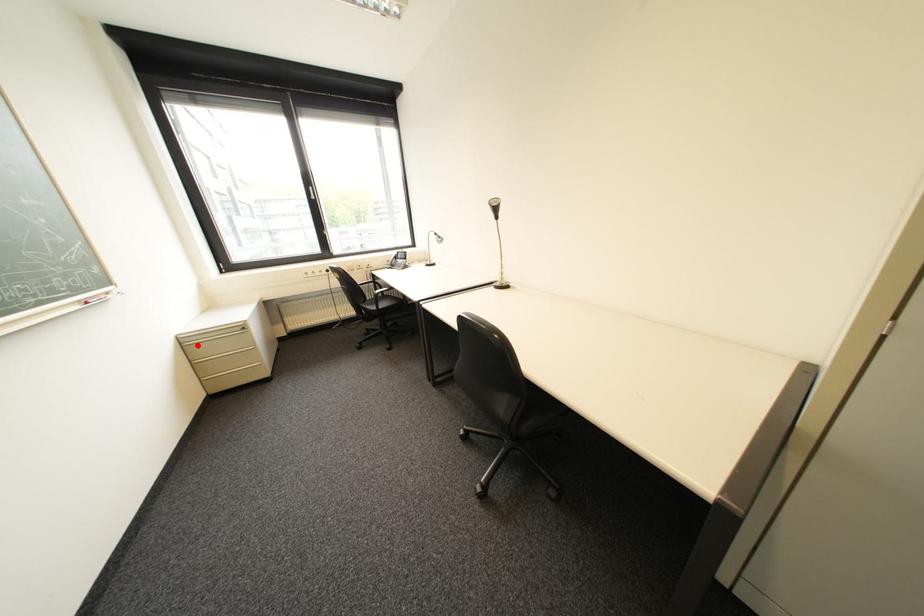
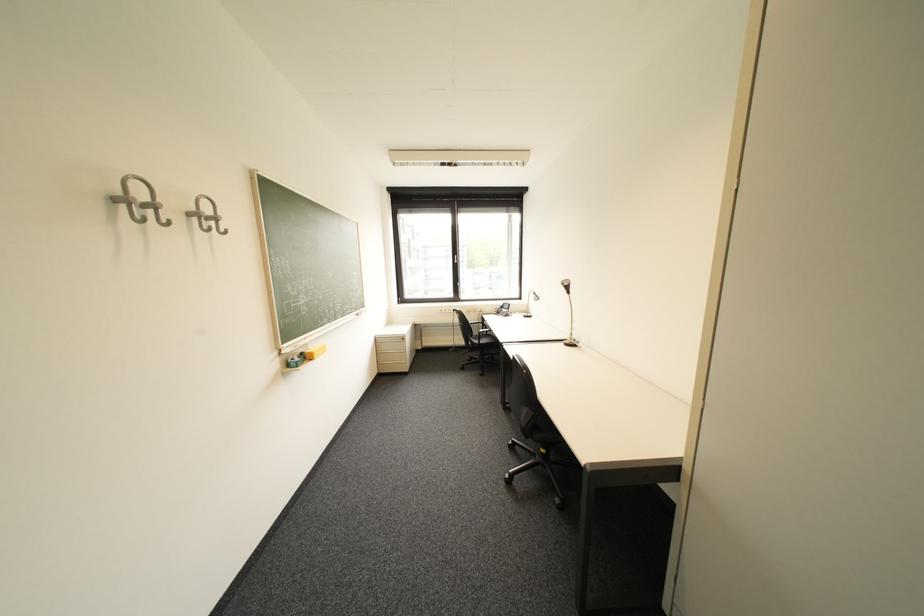
Locate, in the second image, the point that corresponds to the highlighted location in the first image.

(388, 342)